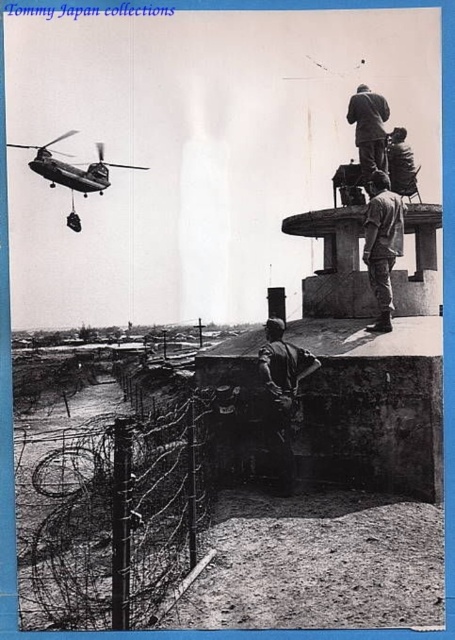
Question: Which point is farther to the camera?

Choices:
 (A) (281, 401)
 (B) (399, 176)
 (C) (358, 138)
 (D) (372, 198)

Answer: (B)

Question: Estimate the real-world distances between objects in this image. Which object is farther from the rugged canvas backpack at upper right?

Choices:
 (A) dark gray uniform at center
 (B) smooth gray uniform at upper center

Answer: (B)

Question: Can you confirm if camouflage fabric soldier at center is thinner than smooth gray uniform at upper center?

Choices:
 (A) yes
 (B) no

Answer: (A)

Question: Observing the image, what is the correct spatial positioning of metallic gray helicopter at upper left in reference to rugged canvas backpack at upper right?

Choices:
 (A) right
 (B) left

Answer: (B)

Question: Which point appears closest to the camera in this image?

Choices:
 (A) (15, 145)
 (B) (377, 163)
 (C) (394, 182)

Answer: (B)

Question: Considering the relative positions of camouflage fabric soldier at center and smooth gray uniform at upper center in the image provided, where is camouflage fabric soldier at center located with respect to smooth gray uniform at upper center?

Choices:
 (A) left
 (B) right

Answer: (A)